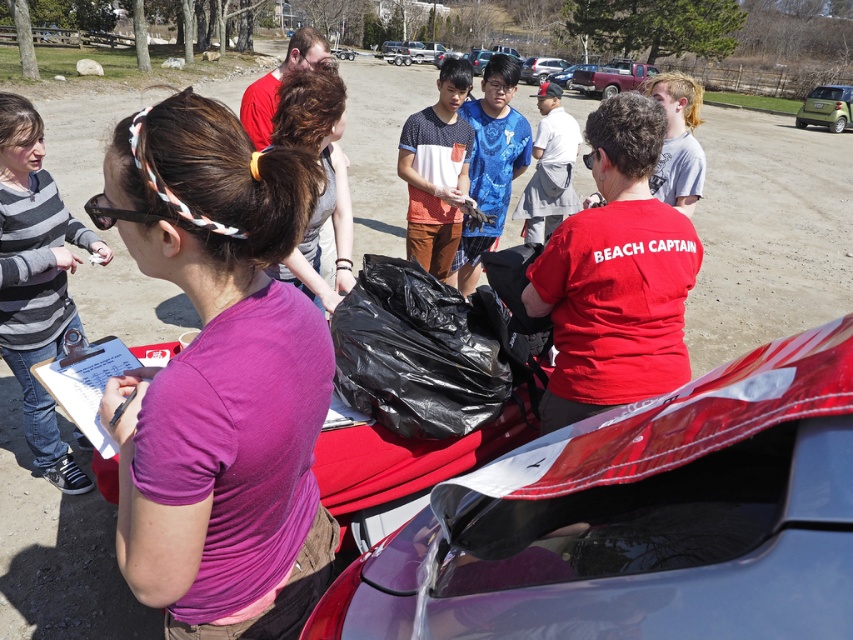
Question: Is brown hair at upper center to the right of metallic silver car at center from the viewer's perspective?

Choices:
 (A) no
 (B) yes

Answer: (A)

Question: Can you confirm if green matte car at upper right is positioned to the left of metallic silver car at center?

Choices:
 (A) no
 (B) yes

Answer: (A)

Question: Can you confirm if purple fabric shirt at center is positioned below red matte shirt at center?

Choices:
 (A) no
 (B) yes

Answer: (B)

Question: Which object is positioned farthest from the glossy plastic car at center?

Choices:
 (A) green matte car at upper right
 (B) metallic silver car at center

Answer: (B)

Question: Among these points, which one is nearest to the camera?

Choices:
 (A) (810, 106)
 (B) (751, 532)

Answer: (B)

Question: Which point is closer to the camera?

Choices:
 (A) (393, 596)
 (B) (289, 93)
 (C) (271, 563)

Answer: (A)